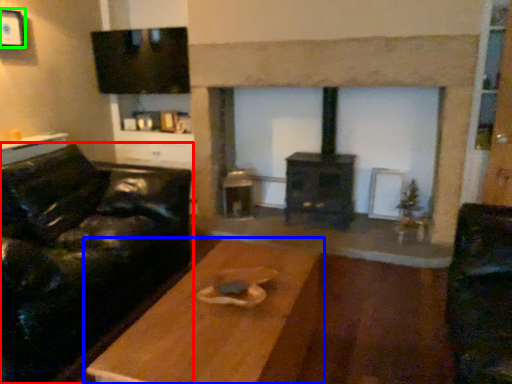
Question: Which is nearer to the studio couch (highlighted by a red box)? table (highlighted by a blue box) or picture frame (highlighted by a green box).

Choices:
 (A) table
 (B) picture frame

Answer: (A)